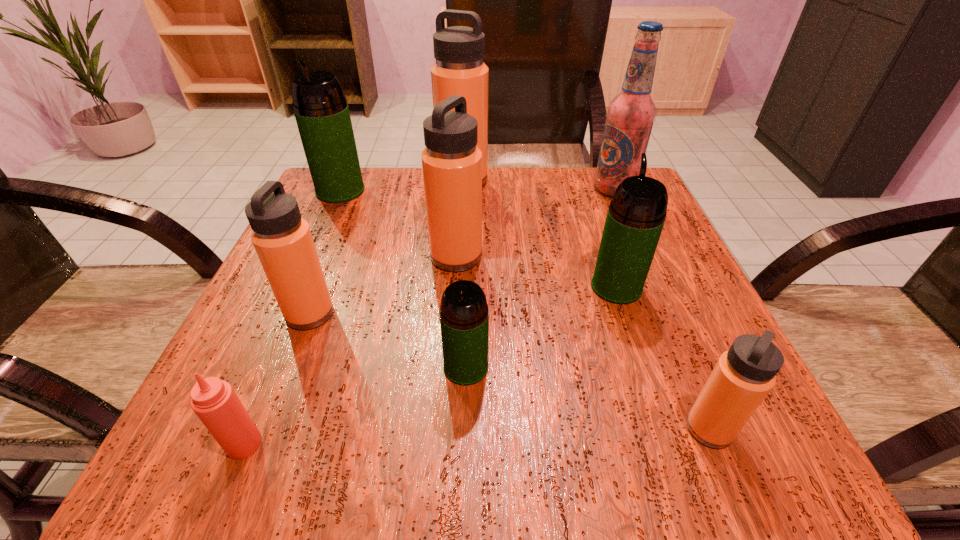
Locate an element on the screen. the seventh farthest object is located at coordinates (464, 317).

This screenshot has width=960, height=540. Identify the location of the smallest green thermos bottle. (464, 317).

The image size is (960, 540). I want to click on the nearest thermos bottle, so click(x=743, y=376).

Identify the location of the rightmost orange thermos bottle. (743, 376).

Identify the location of the shortest object. The height and width of the screenshot is (540, 960). (214, 401).

Identify the location of vacant point located 0.190m on the right of the farthest orange thermos bottle. (566, 180).

Identify the location of vacant space located 0.130m on the left of the blue alcohol. The height and width of the screenshot is (540, 960). (538, 189).

I want to click on free region located from the spout of the leftmost green thermos bottle, so click(x=276, y=333).

This screenshot has width=960, height=540. I want to click on vacant region located 0.260m on the left of the second farthest orange thermos bottle, so click(x=296, y=256).

The height and width of the screenshot is (540, 960). In order to click on vacant area situated 0.210m from the spout of the rightmost green thermos bottle in this screenshot , I will do `click(590, 208)`.